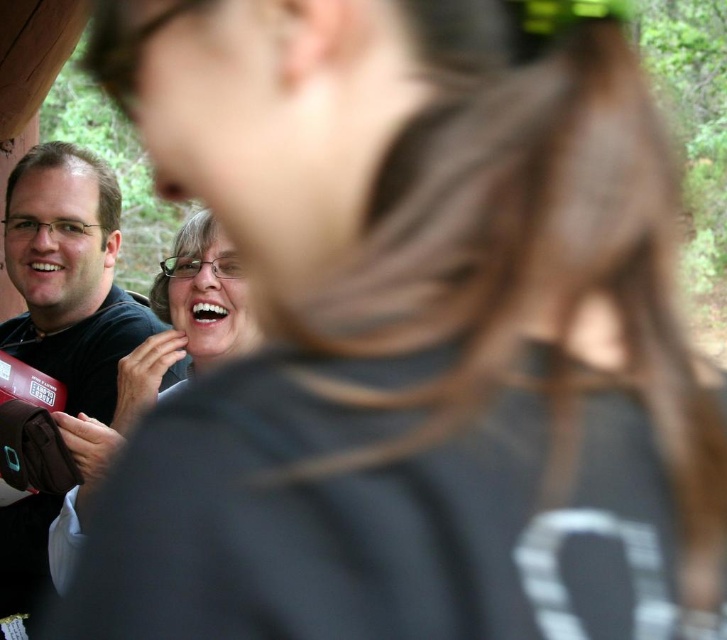
You are a photographer trying to capture a group photo of the matte black shirt at left and the matte black shirt at center. Based on their positions in the image, which one is positioned higher up in the frame?

The matte black shirt at left is positioned higher up in the frame than the matte black shirt at center because it is described as being above it.

From the picture: You are a photographer trying to capture a group photo of the matte black shirt at left and the matte black shirt at center. Which one of them should you focus on first to ensure their shirts are clearly visible in the photo?

The matte black shirt at left has a larger size compared to the matte black shirt at center, so you should focus on the matte black shirt at left first to ensure its details are clearly visible.